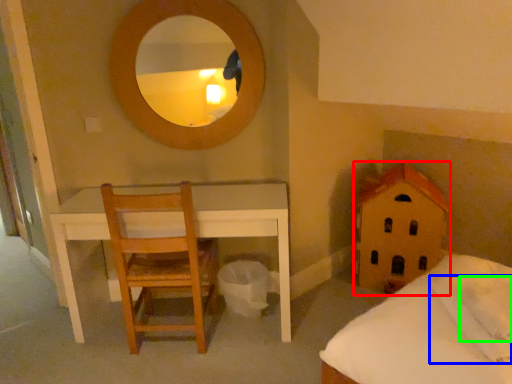
Question: Which object is the closest to the toy (highlighted by a red box)? Choose among these: pillow (highlighted by a blue box) or pillow (highlighted by a green box).

Choices:
 (A) pillow
 (B) pillow

Answer: (A)